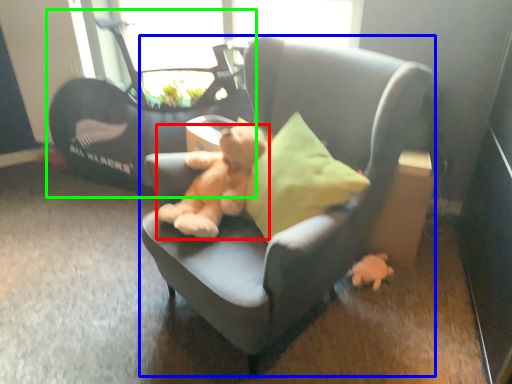
Question: Which object is positioned farthest from teddy bear (highlighted by a red box)? Select from chair (highlighted by a blue box) and baby carriage (highlighted by a green box).

Choices:
 (A) chair
 (B) baby carriage

Answer: (B)